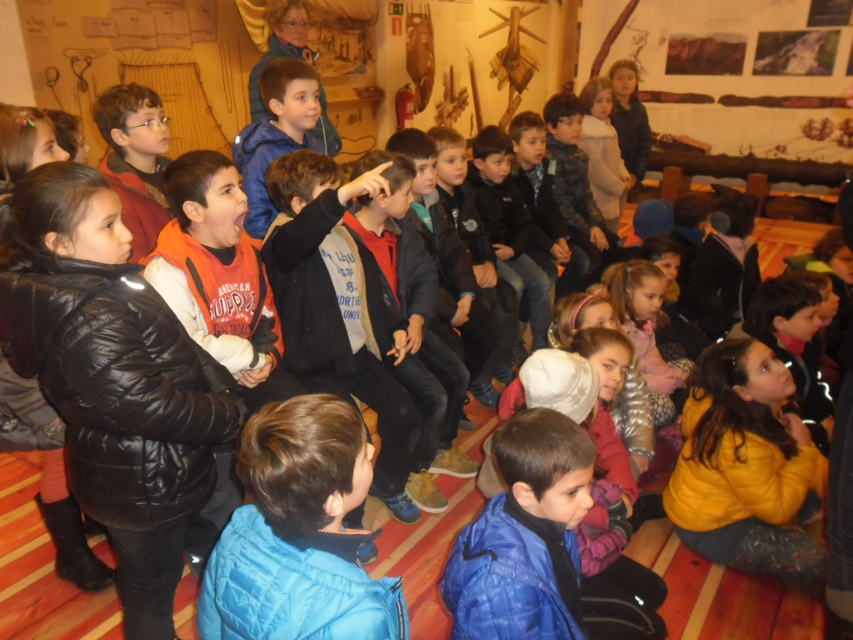
Question: Which object is closer to the camera taking this photo?

Choices:
 (A) blue quilted jacket at center
 (B) yellow fleece jacket at lower right

Answer: (A)

Question: Is blue quilted jacket at center below yellow fleece jacket at lower right?

Choices:
 (A) no
 (B) yes

Answer: (A)

Question: Does blue quilted jacket at center appear under yellow fleece jacket at lower right?

Choices:
 (A) yes
 (B) no

Answer: (B)

Question: Which object is closer to the camera taking this photo?

Choices:
 (A) blue quilted jacket at center
 (B) yellow fleece jacket at lower right

Answer: (A)

Question: Is blue quilted jacket at center wider than yellow fleece jacket at lower right?

Choices:
 (A) yes
 (B) no

Answer: (B)